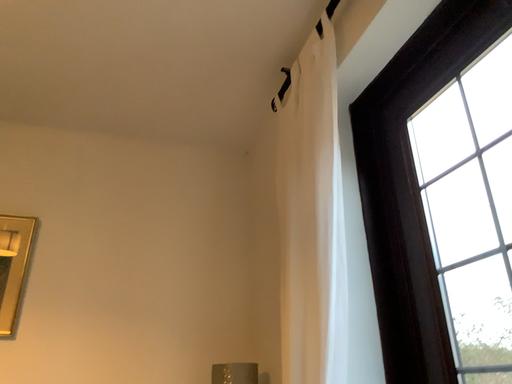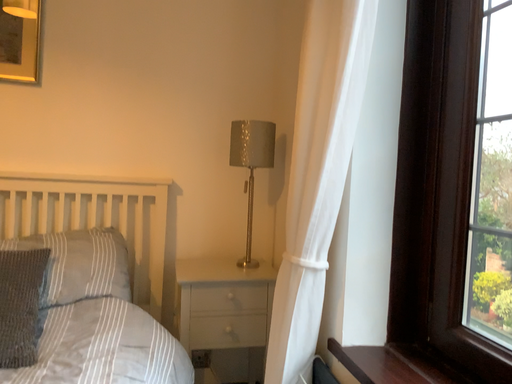
Question: How did the camera likely rotate when shooting the video?

Choices:
 (A) rotated downward
 (B) rotated upward

Answer: (A)